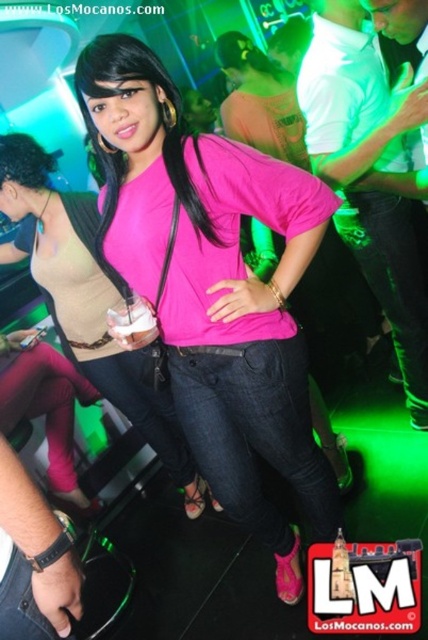
Who is positioned more to the left, white cotton shirt at upper right or pink matte shirt at center?

From the viewer's perspective, pink matte shirt at center appears more on the left side.

Can you confirm if white cotton shirt at upper right is positioned above pink matte shirt at center?

Correct, white cotton shirt at upper right is located above pink matte shirt at center.

Which is in front, point (321, 80) or point (35, 257)?

Point (321, 80) is more forward.

Identify the location of white cotton shirt at upper right. (365, 172).

Who is higher up, matte pink shirt at center or pink matte shirt at center?

matte pink shirt at center is higher up.

Is point (258, 371) positioned behind point (61, 248)?

No, (258, 371) is closer to viewer.

Find the location of a particular element. matte pink shirt at center is located at coordinates (214, 285).

Can you confirm if matte pink shirt at center is positioned above white cotton shirt at upper right?

No.

Is matte pink shirt at center wider than white cotton shirt at upper right?

Indeed, matte pink shirt at center has a greater width compared to white cotton shirt at upper right.

Where is `matte pink shirt at center`? This screenshot has width=428, height=640. matte pink shirt at center is located at coordinates (214, 285).

Locate an element on the screen. Image resolution: width=428 pixels, height=640 pixels. matte pink shirt at center is located at coordinates (214, 285).